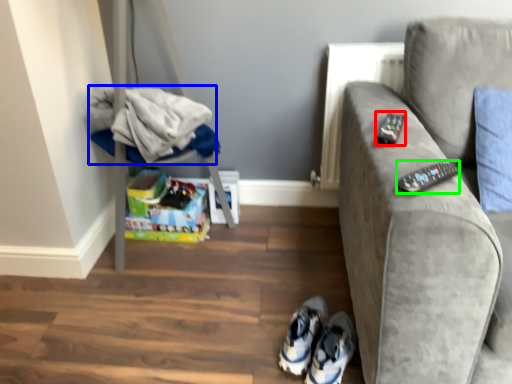
Question: Which object is the closest to the remote (highlighted by a red box)? Choose among these: laundry (highlighted by a blue box) or remote (highlighted by a green box).

Choices:
 (A) laundry
 (B) remote

Answer: (B)